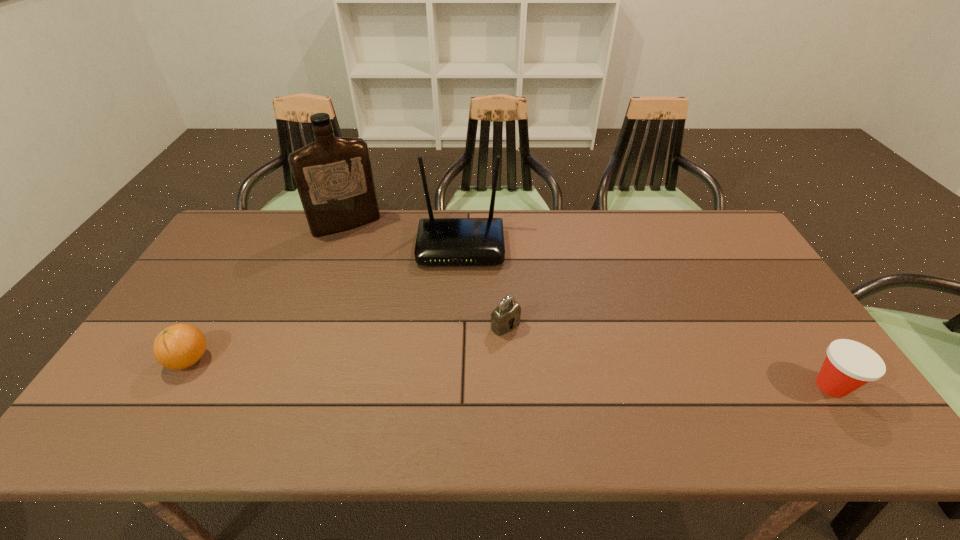
The height and width of the screenshot is (540, 960). I want to click on orange, so [x=179, y=346].

The width and height of the screenshot is (960, 540). Identify the location of Dixie cup. (849, 365).

The height and width of the screenshot is (540, 960). In order to click on the second tallest object in this screenshot , I will do `click(440, 241)`.

Locate an element on the screen. The width and height of the screenshot is (960, 540). the third farthest object is located at coordinates (502, 317).

Locate an element on the screen. Image resolution: width=960 pixels, height=540 pixels. the tallest object is located at coordinates (x=333, y=175).

Locate an element on the screen. The image size is (960, 540). liquor is located at coordinates (333, 175).

Locate an element on the screen. The height and width of the screenshot is (540, 960). blank space located 0.270m on the back of the leftmost object is located at coordinates (240, 274).

Where is `free spot located 0.080m on the back of the rightmost object`? This screenshot has height=540, width=960. free spot located 0.080m on the back of the rightmost object is located at coordinates (802, 342).

This screenshot has width=960, height=540. I want to click on free region located on the front-facing side of the router, so click(457, 365).

You are a GUI agent. You are given a task and a screenshot of the screen. Output one action in this format:
    pyautogui.click(x=<x>, y=<y>)
    Task: Click on the vacant space located 0.370m on the front-facing side of the router
    This screenshot has height=540, width=960.
    Given the screenshot: What is the action you would take?
    pyautogui.click(x=457, y=368)